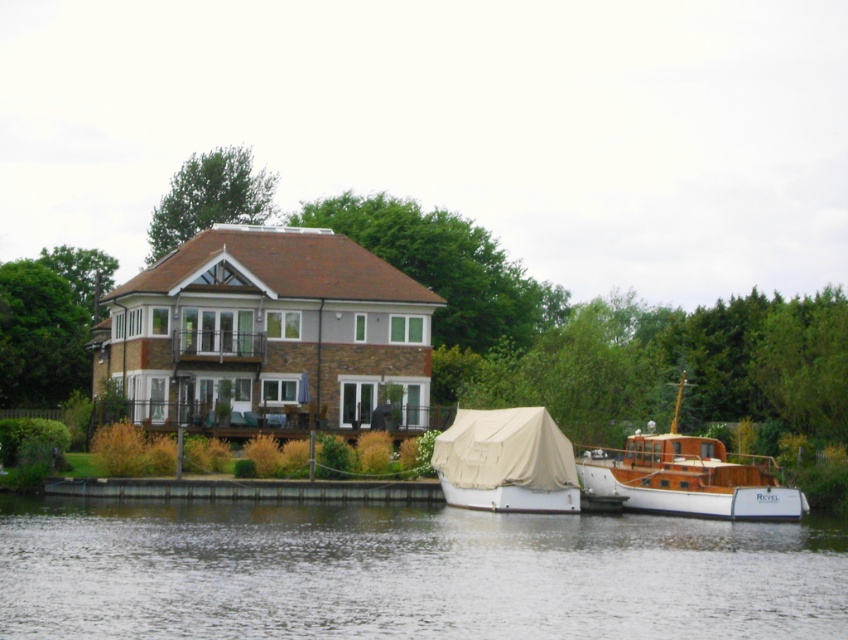
Who is lower down, wooden boat at right or beige canvas boat at lower center?

wooden boat at right is below.

Can you confirm if wooden boat at right is positioned to the right of beige canvas boat at lower center?

Yes, wooden boat at right is to the right of beige canvas boat at lower center.

Does point (633, 504) come in front of point (520, 476)?

No, it is behind (520, 476).

The height and width of the screenshot is (640, 848). Identify the location of wooden boat at right. tap(690, 477).

Can you confirm if transparent water at lower center is smaller than wooden boat at right?

No.

Between transparent water at lower center and wooden boat at right, which one appears on the left side from the viewer's perspective?

Positioned to the left is transparent water at lower center.

At what (x,y) coordinates should I click in order to perform the action: click on transparent water at lower center. Please return your answer as a coordinate pair (x, y). The width and height of the screenshot is (848, 640). Looking at the image, I should click on [x=406, y=572].

Find the location of `transparent water at lower center`. transparent water at lower center is located at coordinates (406, 572).

Can you confirm if transparent water at lower center is shorter than beige canvas boat at lower center?

Yes, transparent water at lower center is shorter than beige canvas boat at lower center.

Does point (190, 582) come behind point (519, 436)?

That is False.

You are a GUI agent. You are given a task and a screenshot of the screen. Output one action in this format:
    pyautogui.click(x=<x>, y=<y>)
    Task: Click on the transparent water at lower center
    
    Given the screenshot: What is the action you would take?
    pyautogui.click(x=406, y=572)